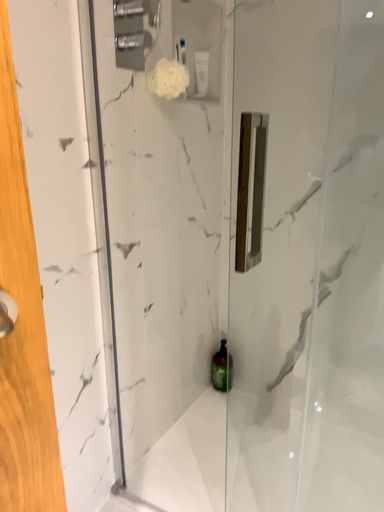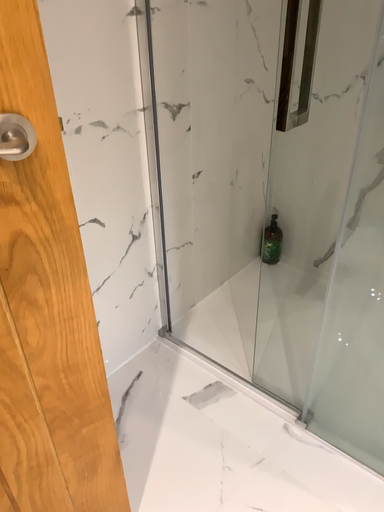
Question: How did the camera likely rotate when shooting the video?

Choices:
 (A) rotated downward
 (B) rotated upward

Answer: (A)